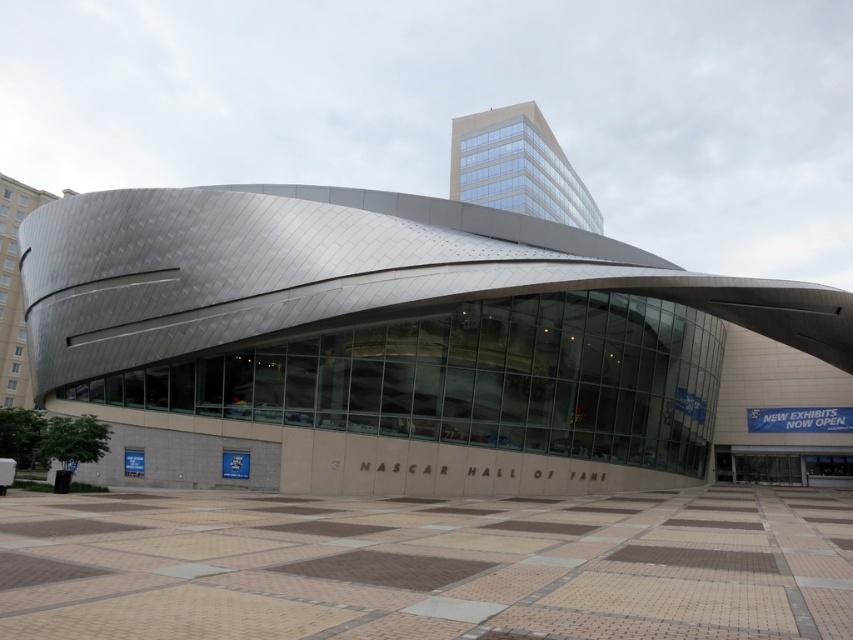
Question: Can you confirm if polished steel building at center is smaller than glassy reflective building at upper center?

Choices:
 (A) yes
 (B) no

Answer: (B)

Question: Can you confirm if polished steel building at center is positioned below glassy reflective building at upper center?

Choices:
 (A) yes
 (B) no

Answer: (A)

Question: Which point is closer to the camera?

Choices:
 (A) glassy reflective building at upper center
 (B) polished steel building at center

Answer: (B)

Question: Is polished steel building at center bigger than glassy reflective building at upper center?

Choices:
 (A) no
 (B) yes

Answer: (B)

Question: Among these points, which one is farthest from the camera?

Choices:
 (A) click(x=593, y=205)
 (B) click(x=785, y=390)

Answer: (A)

Question: Among these objects, which one is nearest to the camera?

Choices:
 (A) glassy reflective building at upper center
 (B) polished steel building at center

Answer: (B)